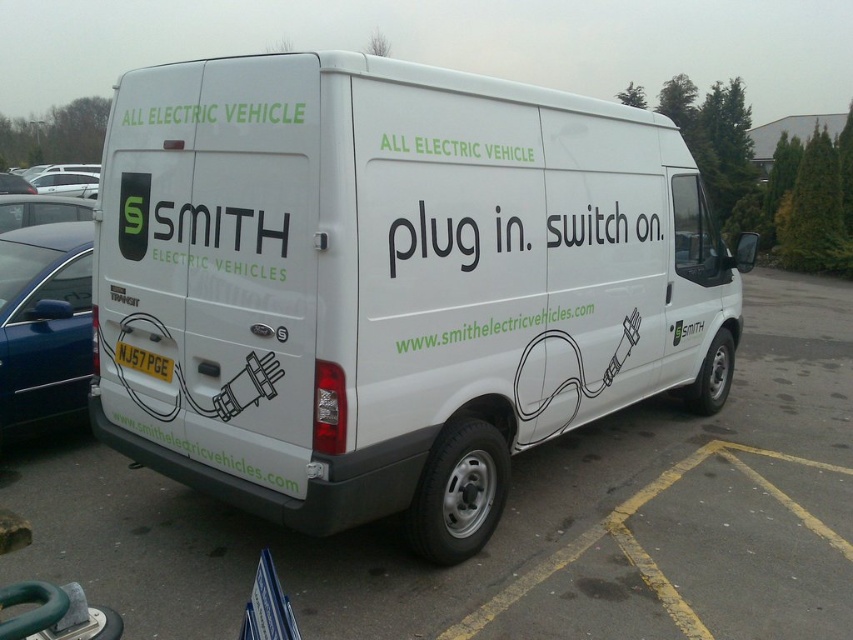
Can you confirm if white matte van at center is positioned to the left of white van at center?

Indeed, white matte van at center is positioned on the left side of white van at center.

This screenshot has width=853, height=640. In order to click on white matte van at center in this screenshot , I will do `click(390, 284)`.

Is point (96, 292) behind point (64, 486)?

No, it is in front of (64, 486).

At what (x,y) coordinates should I click in order to perform the action: click on white matte van at center. Please return your answer as a coordinate pair (x, y). This screenshot has width=853, height=640. Looking at the image, I should click on (390, 284).

Which is more to the right, white matte van at center or matte black car at left?

white matte van at center is more to the right.

What do you see at coordinates (390, 284) in the screenshot? I see `white matte van at center` at bounding box center [390, 284].

Identify the location of white matte van at center. (x=390, y=284).

Is white van at center above matte black car at left?

Incorrect, white van at center is not positioned above matte black car at left.

Is white van at center shorter than matte black car at left?

Yes, white van at center is shorter than matte black car at left.

You are a GUI agent. You are given a task and a screenshot of the screen. Output one action in this format:
    pyautogui.click(x=<x>, y=<y>)
    Task: Click on the white van at center
    The width and height of the screenshot is (853, 640).
    Given the screenshot: What is the action you would take?
    pyautogui.click(x=515, y=520)